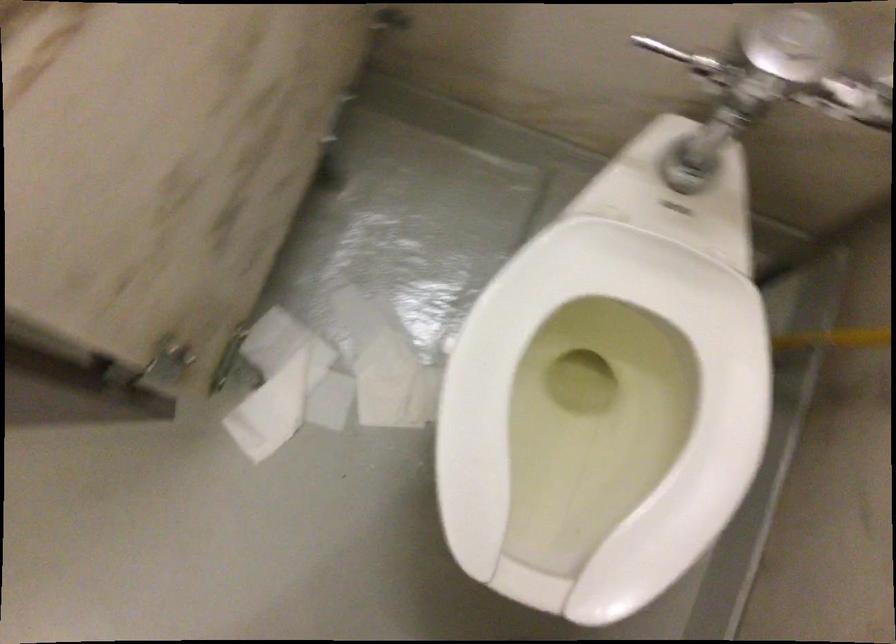
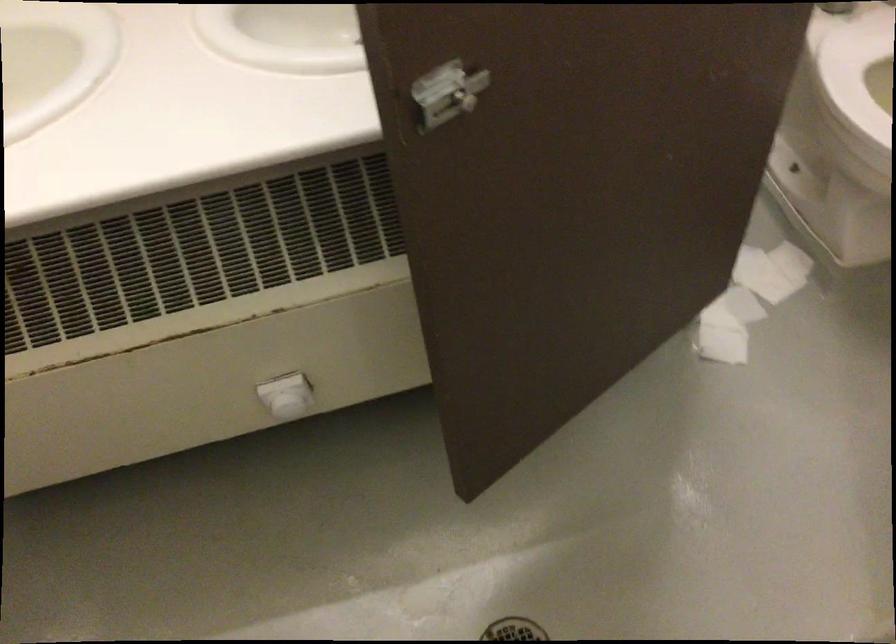
The point at [309,415] is marked in the first image. Where is the corresponding point in the second image?

(739, 305)